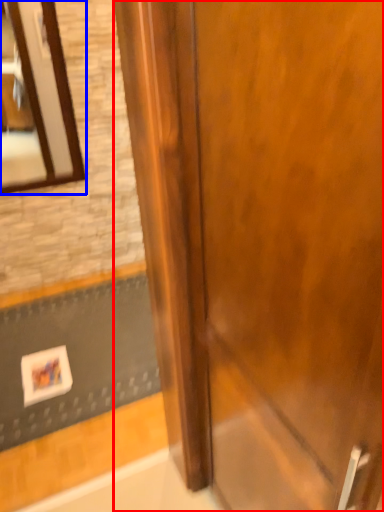
Question: Which of the following is the closest to the observer, door (highlighted by a red box) or mirror (highlighted by a blue box)?

Choices:
 (A) door
 (B) mirror

Answer: (A)